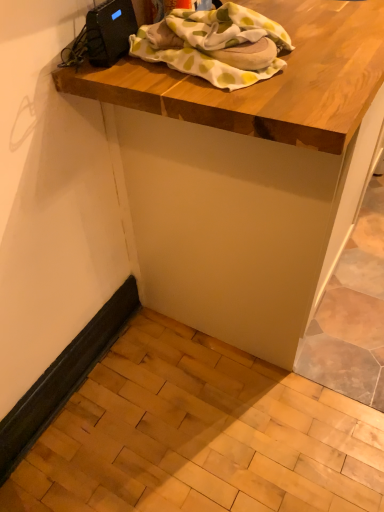
Question: From the image's perspective, relative to white cotton blanket at upper center, is wooden table at upper center above or below?

Choices:
 (A) below
 (B) above

Answer: (B)

Question: Would you say wooden table at upper center is inside or outside white cotton blanket at upper center?

Choices:
 (A) inside
 (B) outside

Answer: (B)

Question: In the image, is wooden table at upper center positioned in front of or behind white cotton blanket at upper center?

Choices:
 (A) front
 (B) behind

Answer: (A)

Question: From a real-world perspective, is white cotton blanket at upper center above or below wooden table at upper center?

Choices:
 (A) below
 (B) above

Answer: (B)

Question: Does point (258, 38) appear closer or farther from the camera than point (256, 237)?

Choices:
 (A) farther
 (B) closer

Answer: (B)

Question: From the image's perspective, relative to wooden table at upper center, is white cotton blanket at upper center above or below?

Choices:
 (A) above
 (B) below

Answer: (B)

Question: Would you say white cotton blanket at upper center is inside or outside wooden table at upper center?

Choices:
 (A) outside
 (B) inside

Answer: (A)